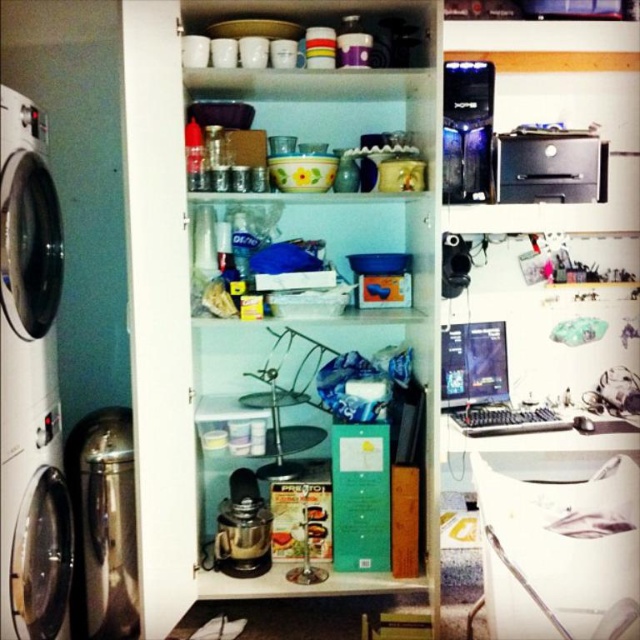
Looking at this image, you are moving these items to a new storage unit. The entrance of the unit has a height restriction of 1 meter. Which item between the brushed metal dish washer at left and the black plastic printer at upper right might not fit through the entrance due to its height?

The brushed metal dish washer at left is bigger than the black plastic printer at upper right, so the brushed metal dish washer at left might not fit through the entrance due to its height.

You are standing in the utility space and want to reach two points marked in the image. Which point, point (x=96, y=445) or point (x=499, y=180), is easier to reach without moving your position?

Point (x=96, y=445) is closer to the camera than point (x=499, y=180), so it is easier to reach without moving your position.